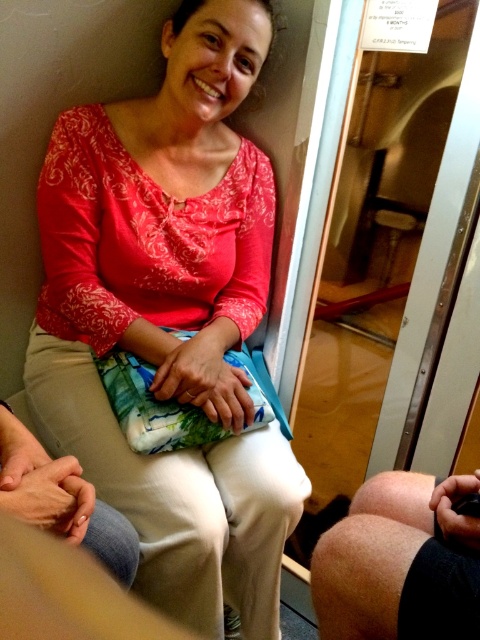
Is matte red blouse at center in front of smooth skin knee at lower right?

No, it is not.

Does matte red blouse at center have a lesser height compared to smooth skin knee at lower right?

In fact, matte red blouse at center may be taller than smooth skin knee at lower right.

Between point (267, 168) and point (433, 611), which one is positioned in front?

Point (433, 611)

Locate an element on the screen. The width and height of the screenshot is (480, 640). matte red blouse at center is located at coordinates (170, 316).